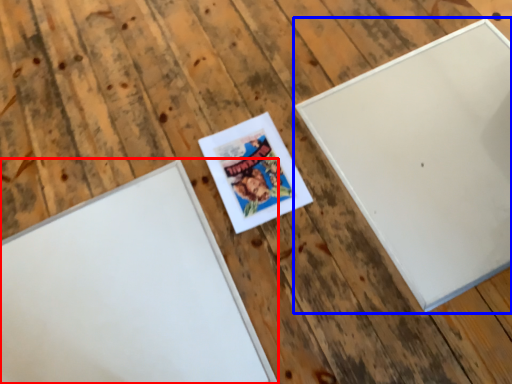
Question: Which of the following is the farthest to the observer, picture frame (highlighted by a red box) or picture frame (highlighted by a blue box)?

Choices:
 (A) picture frame
 (B) picture frame

Answer: (B)